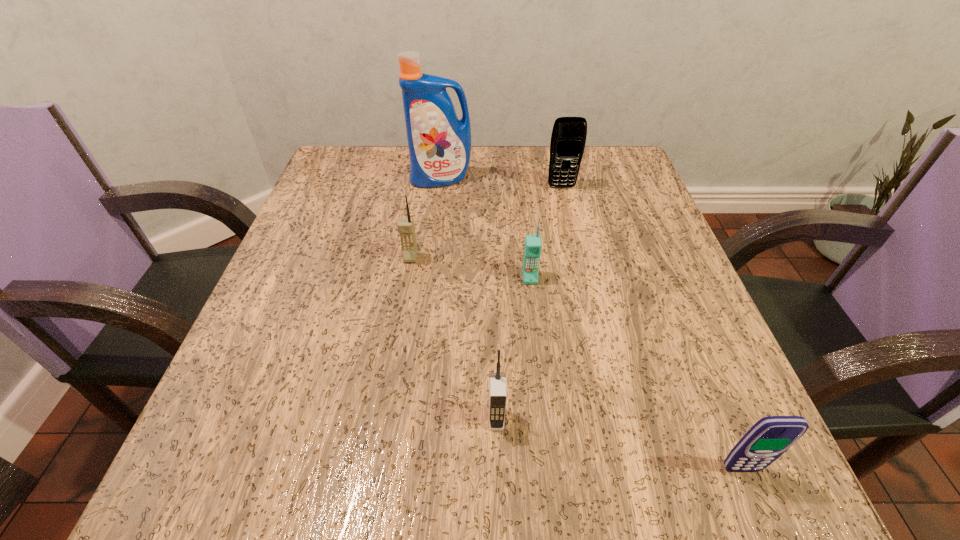
Identify the location of free space between the leftmost cellular telephone and the second cellular telephone from left to right. (453, 339).

The image size is (960, 540). Find the location of `free spot between the rightmost cellular telephone and the detergent`. free spot between the rightmost cellular telephone and the detergent is located at coordinates (591, 324).

In order to click on free space between the third farthest object and the fourth object from right to left in this screenshot , I will do `click(453, 339)`.

Where is `free space between the rightmost cellular telephone and the farthest cellular telephone`? The width and height of the screenshot is (960, 540). free space between the rightmost cellular telephone and the farthest cellular telephone is located at coordinates (651, 328).

This screenshot has height=540, width=960. In order to click on free space between the farthest cellular telephone and the third cellular telephone from right to left in this screenshot , I will do `click(545, 232)`.

Where is `vacant area that lies between the third cellular telephone from left to right and the tallest object`? This screenshot has width=960, height=540. vacant area that lies between the third cellular telephone from left to right and the tallest object is located at coordinates (486, 228).

Locate an element on the screen. free space between the fourth nearest cellular telephone and the tallest object is located at coordinates click(x=426, y=219).

Identify which object is the fifth nearest to the tallest object. Please provide its 2D coordinates. Your answer should be formatted as a tuple, i.e. [(x, y)], where the tuple contains the x and y coordinates of a point satisfying the conditions above.

[(770, 437)]

Select which object appears as the third closest to the tallest object. Please provide its 2D coordinates. Your answer should be formatted as a tuple, i.e. [(x, y)], where the tuple contains the x and y coordinates of a point satisfying the conditions above.

[(532, 249)]

Identify the location of the closest cellular telephone relative to the fourth object from left to right. (406, 228).